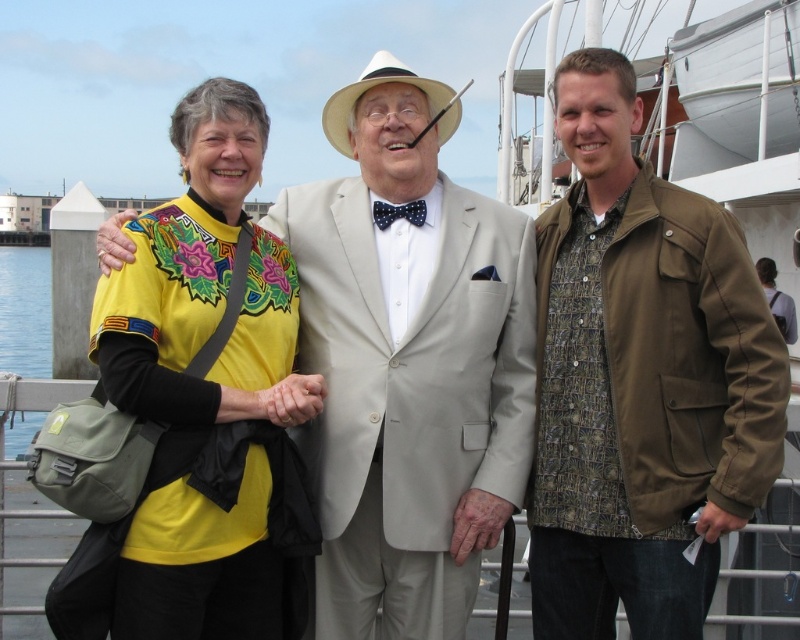
What are the coordinates of the light beige suit at center?

The light beige suit at center is located at coordinates point (408, 362).